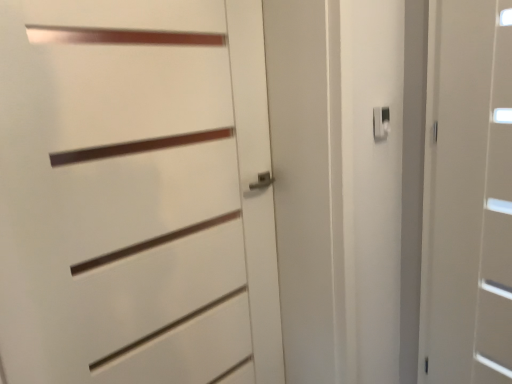
Question: Is white matte door at right, which ranks as the 2th door in left-to-right order, taller or shorter than white matte door at center, which is counted as the 1th door, starting from the left?

Choices:
 (A) short
 (B) tall

Answer: (B)

Question: Is white matte door at right, placed as the first door when sorted from right to left, situated inside white matte door at center, which is counted as the 1th door, starting from the left, or outside?

Choices:
 (A) inside
 (B) outside

Answer: (B)

Question: Which object is the closest to the white plastic latch at upper right?

Choices:
 (A) white matte door at center, which is counted as the 1th door, starting from the left
 (B) white matte door at right, which ranks as the 2th door in left-to-right order

Answer: (B)

Question: Which object is positioned farthest from the white plastic latch at upper right?

Choices:
 (A) white matte door at center, which is counted as the 2th door, starting from the right
 (B) white matte door at right, which ranks as the 2th door in left-to-right order

Answer: (A)